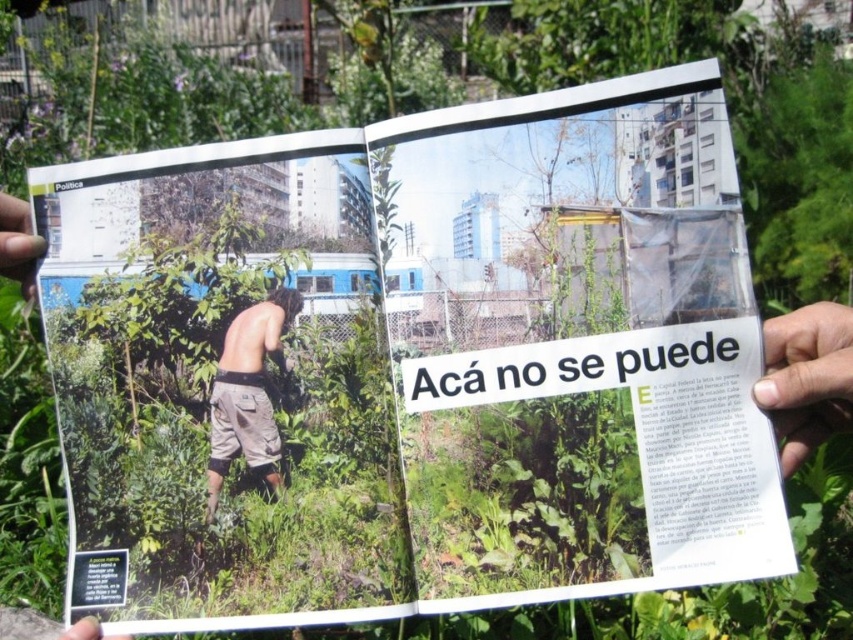
Question: Is tan canvas shorts at center above smooth skin hand at upper left?

Choices:
 (A) no
 (B) yes

Answer: (A)

Question: Among these objects, which one is farthest from the camera?

Choices:
 (A) smooth skin hand at upper left
 (B) dark skin hand at right

Answer: (A)

Question: Is dark skin hand at right wider than tan canvas shorts at center?

Choices:
 (A) yes
 (B) no

Answer: (A)

Question: Which point is farther to the camera?

Choices:
 (A) dark skin hand at right
 (B) tan canvas shorts at center
 (C) smooth skin hand at upper left

Answer: (B)

Question: In this image, where is dark skin hand at right located relative to tan canvas shorts at center?

Choices:
 (A) right
 (B) left

Answer: (A)

Question: Which object is positioned closest to the tan canvas shorts at center?

Choices:
 (A) dark skin hand at right
 (B) smooth skin hand at upper left

Answer: (B)